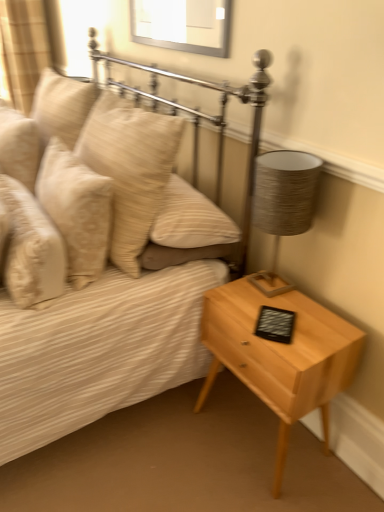
I want to click on free spot in front of textured gray lampshade at right, so click(298, 319).